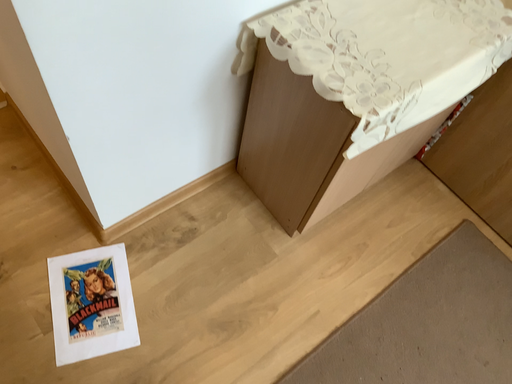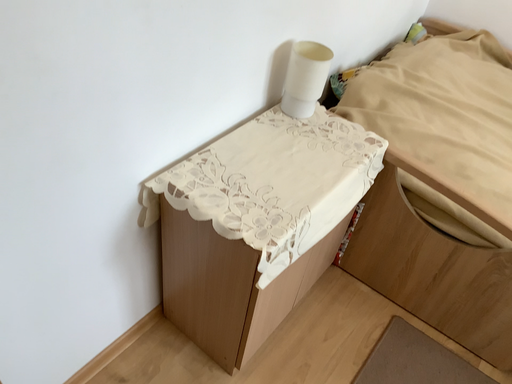
Question: Which way did the camera rotate in the video?

Choices:
 (A) rotated upward
 (B) rotated downward

Answer: (A)